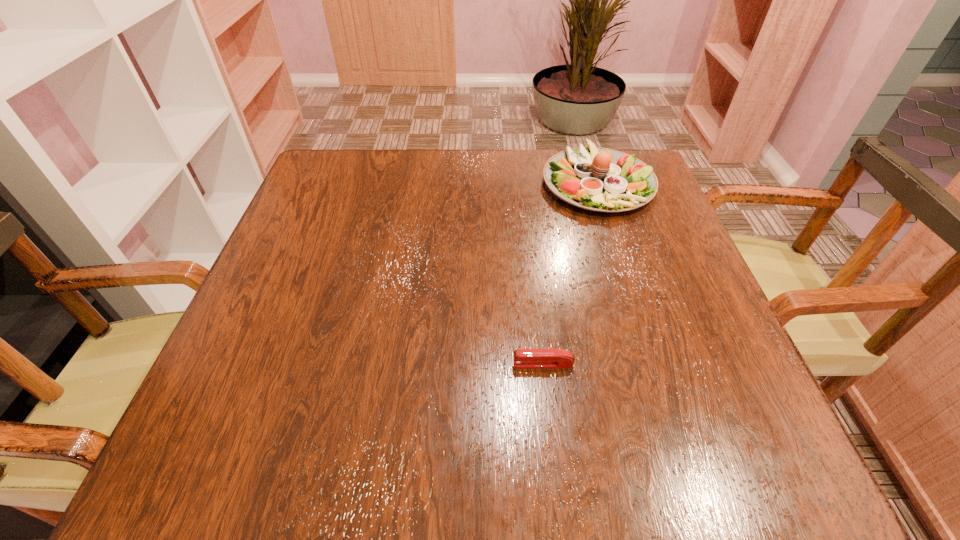
Where is `object that is at the far right corner`? This screenshot has width=960, height=540. object that is at the far right corner is located at coordinates (599, 179).

What are the coordinates of `free region at the far edge of the desktop` in the screenshot? It's located at (470, 176).

At what (x,y) coordinates should I click in order to perform the action: click on vacant space at the left edge. Please return your answer as a coordinate pair (x, y). Looking at the image, I should click on (310, 368).

Identify the location of blank space at the right edge of the desktop. This screenshot has height=540, width=960. (619, 220).

Identify the location of free spot at the far left corner of the desktop. (330, 200).

In order to click on vacant area at the near left corner in this screenshot , I will do `click(258, 431)`.

Identify the location of vacant space that satisfies the following two spatial constraints: 1. on the front side of the farther object; 2. on the front-facing side of the left object. (x=656, y=364).

At what (x,y) coordinates should I click in order to perform the action: click on vacant space that satisfies the following two spatial constraints: 1. on the front side of the right object; 2. on the front-facing side of the shorter object. Please return your answer as a coordinate pair (x, y). The width and height of the screenshot is (960, 540). Looking at the image, I should click on (656, 364).